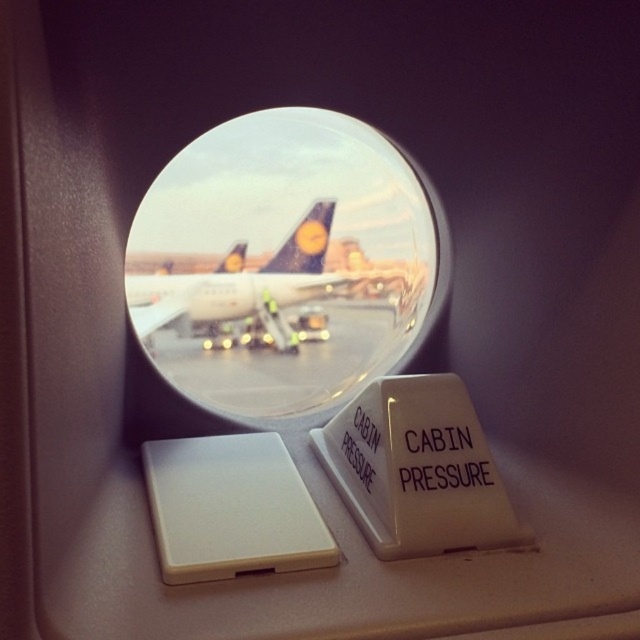
You are a flight attendant checking the cabin. You see the transparent glass airplane window at center and the white glossy airplane at center. Which object is wider?

The transparent glass airplane window at center is wider than the white glossy airplane at center according to the description.

You are a flight attendant checking the cabin. You see the transparent glass airplane window at center and the smooth concrete tarmac at center reflected in the window. Which object is positioned to the right side from your viewpoint?

The transparent glass airplane window at center is to the right of the smooth concrete tarmac at center, so the transparent glass airplane window at center is positioned to the right side from your viewpoint.

You are a flight attendant checking the cabin window reflections. You see the smooth concrete tarmac at center and the white glossy airplane at center. Which object is positioned lower in the reflection?

The smooth concrete tarmac at center is located below the white glossy airplane at center in the reflection.